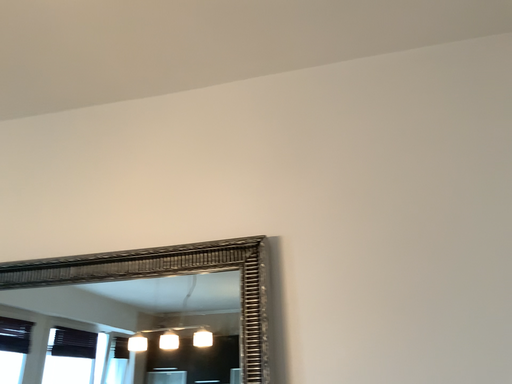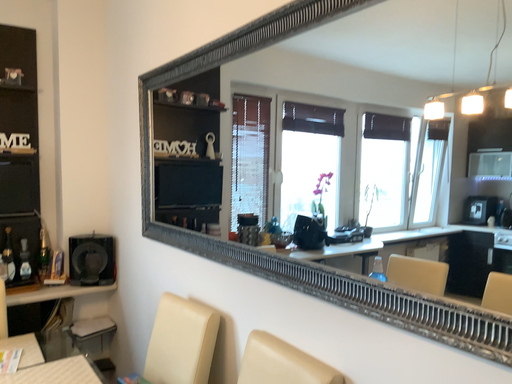
Question: Which way did the camera rotate in the video?

Choices:
 (A) rotated right
 (B) rotated left

Answer: (B)